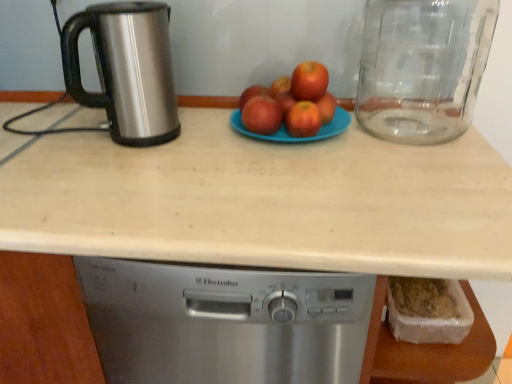
The width and height of the screenshot is (512, 384). Identify the location of red matte apple at center, positioned as the first apple in right-to-left order. (326, 107).

Describe the element at coordinates (303, 119) in the screenshot. The width and height of the screenshot is (512, 384). I see `red matte apple at center, the fourth apple when ordered from left to right` at that location.

Locate an element on the screen. The width and height of the screenshot is (512, 384). red matte apple at center, arranged as the 1th apple when viewed from the left is located at coordinates (252, 94).

Locate an element on the screen. The height and width of the screenshot is (384, 512). red matte apple at center, positioned as the first apple in right-to-left order is located at coordinates (326, 107).

Is red matte apple at center, which is the 5th apple in left-to-right order, smaller than red matte apple at center, arranged as the 1th apple when viewed from the left?

No, red matte apple at center, which is the 5th apple in left-to-right order, is not smaller than red matte apple at center, arranged as the 1th apple when viewed from the left.

Is red matte apple at center, which is the 5th apple in left-to-right order, shorter than red matte apple at center, marked as the sixth apple in a right-to-left arrangement?

No.

Is red matte apple at center, which ranks as the second apple in right-to-left order, at the left side of red matte apple at center, marked as the sixth apple in a right-to-left arrangement?

Incorrect, red matte apple at center, which ranks as the second apple in right-to-left order, is not on the left side of red matte apple at center, marked as the sixth apple in a right-to-left arrangement.

Can you tell me how much red matte apple at center, which ranks as the second apple in right-to-left order, and red matte apple at center, arranged as the 1th apple when viewed from the left, differ in facing direction?

0.00618 degrees.

Looking at their sizes, would you say red matte apples at center, marked as the 2th apple in a left-to-right arrangement, is wider or thinner than beige laminate countertop at center?

Clearly, red matte apples at center, marked as the 2th apple in a left-to-right arrangement, has less width compared to beige laminate countertop at center.

Considering the relative positions of red matte apples at center, the fifth apple viewed from the right, and beige laminate countertop at center in the image provided, is red matte apples at center, the fifth apple viewed from the right, behind beige laminate countertop at center?

Yes, red matte apples at center, the fifth apple viewed from the right, is behind beige laminate countertop at center.

How far apart are red matte apples at center, marked as the 2th apple in a left-to-right arrangement, and beige laminate countertop at center?

A distance of 11.15 inches exists between red matte apples at center, marked as the 2th apple in a left-to-right arrangement, and beige laminate countertop at center.

Considering the sizes of objects red matte apples at center, marked as the 2th apple in a left-to-right arrangement, and beige laminate countertop at center in the image provided, who is smaller, red matte apples at center, marked as the 2th apple in a left-to-right arrangement, or beige laminate countertop at center?

red matte apples at center, marked as the 2th apple in a left-to-right arrangement, is smaller.

Is stainless steel kettle at left at the back of beige laminate countertop at center?

beige laminate countertop at center does not have its back to stainless steel kettle at left.

How different are the orientations of beige laminate countertop at center and stainless steel kettle at left in degrees?

39 degrees separate the facing orientations of beige laminate countertop at center and stainless steel kettle at left.

Is beige laminate countertop at center wider or thinner than stainless steel kettle at left?

beige laminate countertop at center is wider than stainless steel kettle at left.

Would you say stainless steel kettle at left is part of beige laminate countertop at center's contents?

No, stainless steel kettle at left is not a part of beige laminate countertop at center.

Measure the distance from stainless steel kettle at left to red matte apples at center, marked as the 2th apple in a left-to-right arrangement.

They are 10.24 inches apart.

I want to click on kitchen appliance above the red matte apples at center, the fifth apple viewed from the right (from the image's perspective), so click(x=126, y=69).

Does stainless steel kettle at left appear on the left side of red matte apples at center, marked as the 2th apple in a left-to-right arrangement?

Correct, you'll find stainless steel kettle at left to the left of red matte apples at center, marked as the 2th apple in a left-to-right arrangement.

Which is in front, matte blue plate at center or beige laminate countertop at center?

beige laminate countertop at center is more forward.

Would you say matte blue plate at center contains beige laminate countertop at center?

No.

Can you confirm if matte blue plate at center is thinner than beige laminate countertop at center?

Correct, the width of matte blue plate at center is less than that of beige laminate countertop at center.

In order to click on countertop on the left of the matte blue plate at center in this screenshot , I will do `click(265, 202)`.

Which object is positioned more to the left, red matte apples at center, marked as the 2th apple in a left-to-right arrangement, or red matte apple at center, positioned as the first apple in right-to-left order?

red matte apples at center, marked as the 2th apple in a left-to-right arrangement, is more to the left.

How distant is red matte apples at center, the fifth apple viewed from the right, from red matte apple at center, the 6th apple when ordered from left to right?

They are 4.58 inches apart.

Based on the photo, from the image's perspective, is red matte apples at center, marked as the 2th apple in a left-to-right arrangement, positioned above or below red matte apple at center, the 6th apple when ordered from left to right?

Based on their image positions, red matte apples at center, marked as the 2th apple in a left-to-right arrangement, is located beneath red matte apple at center, the 6th apple when ordered from left to right.

Which is closer, (x=258, y=125) or (x=324, y=95)?

The point (x=258, y=125) is in front.

From the picture: Is red matte apples at center, the fifth apple viewed from the right, oriented towards stainless steel kettle at left?

No, red matte apples at center, the fifth apple viewed from the right, is not facing towards stainless steel kettle at left.

From the image's perspective, is red matte apples at center, marked as the 2th apple in a left-to-right arrangement, below stainless steel kettle at left?

Yes, from the image's perspective, red matte apples at center, marked as the 2th apple in a left-to-right arrangement, is below stainless steel kettle at left.

In the scene shown: Are red matte apples at center, the fifth apple viewed from the right, and stainless steel kettle at left located far from each other?

No, red matte apples at center, the fifth apple viewed from the right, is not far from stainless steel kettle at left.

This screenshot has height=384, width=512. I want to click on apple that is the 1st object located below the red matte apple at center, which ranks as the second apple in right-to-left order (from the image's perspective), so click(x=252, y=94).

Locate an element on the screen. The width and height of the screenshot is (512, 384). countertop that is on the left side of red matte apples at center, the fifth apple viewed from the right is located at coordinates (265, 202).

Which object lies further to the anchor point transparent glass jar at right, red matte apple at center, the fourth apple when ordered from left to right, or stainless steel kettle at left?

stainless steel kettle at left.

When comparing their distances from red matte apple at center, marked as the sixth apple in a right-to-left arrangement, does red matte apple at center, the 6th apple when ordered from left to right, or stainless steel kettle at left seem further?

Based on the image, stainless steel kettle at left appears to be further to red matte apple at center, marked as the sixth apple in a right-to-left arrangement.

In the scene shown: Which object lies nearer to the anchor point red matte apple at center, the 6th apple when ordered from left to right, red matte apple at center, the fourth apple when ordered from left to right, or red matte apple at center, marked as the sixth apple in a right-to-left arrangement?

Based on the image, red matte apple at center, the fourth apple when ordered from left to right, appears to be nearer to red matte apple at center, the 6th apple when ordered from left to right.

Based on their spatial positions, is red matte apples at center, the fifth apple viewed from the right, or red matte apple at center, positioned as the first apple in right-to-left order, closer to matte blue plate at center?

red matte apples at center, the fifth apple viewed from the right, lies closer to matte blue plate at center than the other object.

Estimate the real-world distances between objects in this image. Which object is further from matte blue plate at center, stainless steel kettle at left or red matte apple at center, which ranks as the 4th apple in right-to-left order?

The object further to matte blue plate at center is stainless steel kettle at left.

When comparing their distances from stainless steel kettle at left, does transparent glass jar at right or matte blue plate at center seem closer?

Among the two, matte blue plate at center is located nearer to stainless steel kettle at left.

Considering their positions, is beige laminate countertop at center positioned further to red matte apples at center, marked as the 2th apple in a left-to-right arrangement, than red matte apple at center, positioned as the first apple in right-to-left order?

Among the two, beige laminate countertop at center is located further to red matte apples at center, marked as the 2th apple in a left-to-right arrangement.

Estimate the real-world distances between objects in this image. Which object is closer to beige laminate countertop at center, stainless steel kettle at left or red matte apples at center, the fifth apple viewed from the right?

stainless steel kettle at left is positioned closer to the anchor beige laminate countertop at center.

Locate an element on the screen. Image resolution: width=512 pixels, height=384 pixels. apple situated between red matte apples at center, marked as the 2th apple in a left-to-right arrangement, and red matte apple at center, the fourth apple when ordered from left to right, from left to right is located at coordinates (285, 102).

Where is `glass plate between stainless steel kettle at left and beige laminate countertop at center in the vertical direction`? glass plate between stainless steel kettle at left and beige laminate countertop at center in the vertical direction is located at coordinates (x=291, y=135).

What are the coordinates of `glass plate between stainless steel kettle at left and transparent glass jar at right from left to right` in the screenshot? It's located at (291, 135).

Find the location of a particular element. Image resolution: width=512 pixels, height=384 pixels. glass plate between red matte apple at center, arranged as the 1th apple when viewed from the left, and red matte apple at center, positioned as the first apple in right-to-left order, in the horizontal direction is located at coordinates (291, 135).